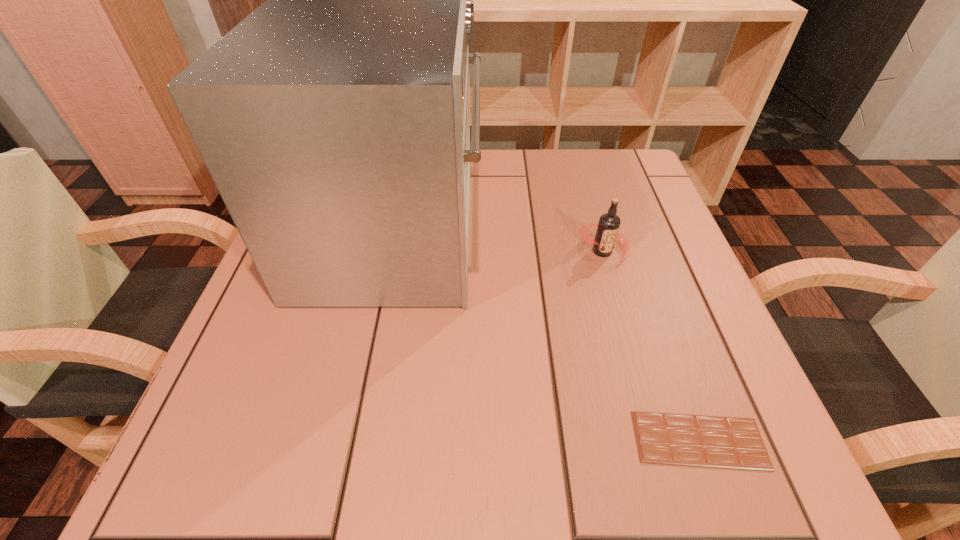
Choose which object is the nearest neighbor to the second tallest object. Please provide its 2D coordinates. Your answer should be formatted as a tuple, i.e. [(x, y)], where the tuple contains the x and y coordinates of a point satisfying the conditions above.

[(334, 120)]

Identify which object is the second closest to the nearest object. Please provide its 2D coordinates. Your answer should be formatted as a tuple, i.e. [(x, y)], where the tuple contains the x and y coordinates of a point satisfying the conditions above.

[(609, 223)]

Locate an element on the screen. This screenshot has width=960, height=540. vacant area that satisfies the following two spatial constraints: 1. on the front panel of the nearest object; 2. on the right side of the tallest object is located at coordinates (351, 441).

The width and height of the screenshot is (960, 540). Identify the location of free location that satisfies the following two spatial constraints: 1. on the label of the nearest object; 2. on the left side of the second shortest object. (656, 441).

Where is `vacant space that satisfies the following two spatial constraints: 1. on the front panel of the toaster oven; 2. on the back side of the nearest object`? The image size is (960, 540). vacant space that satisfies the following two spatial constraints: 1. on the front panel of the toaster oven; 2. on the back side of the nearest object is located at coordinates (351, 441).

Find the location of a particular element. vacant point that satisfies the following two spatial constraints: 1. on the front panel of the chocolate bar; 2. on the right side of the toaster oven is located at coordinates (351, 441).

In order to click on free region that satisfies the following two spatial constraints: 1. on the front panel of the tallest object; 2. on the back side of the shortest object in this screenshot , I will do `click(351, 441)`.

Find the location of `vacant space that satisfies the following two spatial constraints: 1. on the label of the root beer; 2. on the left side of the shortest object`. vacant space that satisfies the following two spatial constraints: 1. on the label of the root beer; 2. on the left side of the shortest object is located at coordinates (656, 441).

Locate an element on the screen. vacant position in the image that satisfies the following two spatial constraints: 1. on the front panel of the shortest object; 2. on the left side of the tallest object is located at coordinates (x=351, y=441).